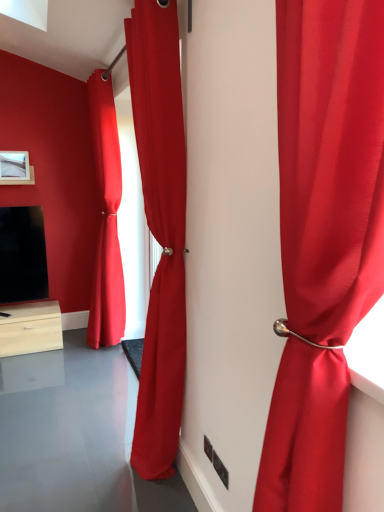
Question: In the image, is matte white picture frame at upper left positioned in front of or behind satin red curtain at center, which ranks as the 2th curtain in right-to-left order?

Choices:
 (A) front
 (B) behind

Answer: (B)

Question: From a real-world perspective, is matte white picture frame at upper left physically located above or below satin red curtain at center, arranged as the 2th curtain when viewed from the left?

Choices:
 (A) below
 (B) above

Answer: (B)

Question: Which object is positioned farthest from the satin red curtain at center, the 2th curtain positioned from the front?

Choices:
 (A) satin red curtain at right, placed as the first curtain when sorted from right to left
 (B) matte white picture frame at upper left
 (C) satin red curtain at center, which is counted as the third curtain, starting from the front

Answer: (B)

Question: Considering the real-world distances, which object is farthest from the satin red curtain at right, the third curtain positioned from the left?

Choices:
 (A) satin red curtain at center, which is counted as the first curtain, starting from the left
 (B) matte white picture frame at upper left
 (C) satin red curtain at center, the 2th curtain viewed from the back

Answer: (B)